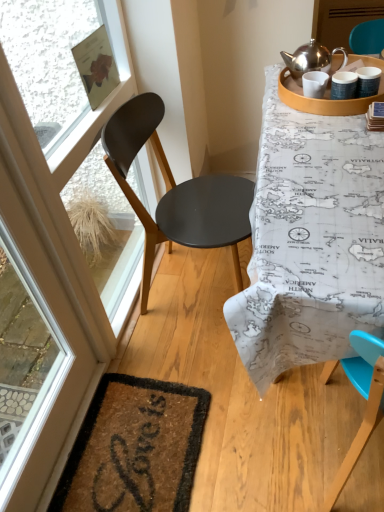
Identify the location of space that is in front of matte wooden tray at upper right. The height and width of the screenshot is (512, 384). pyautogui.click(x=326, y=144).